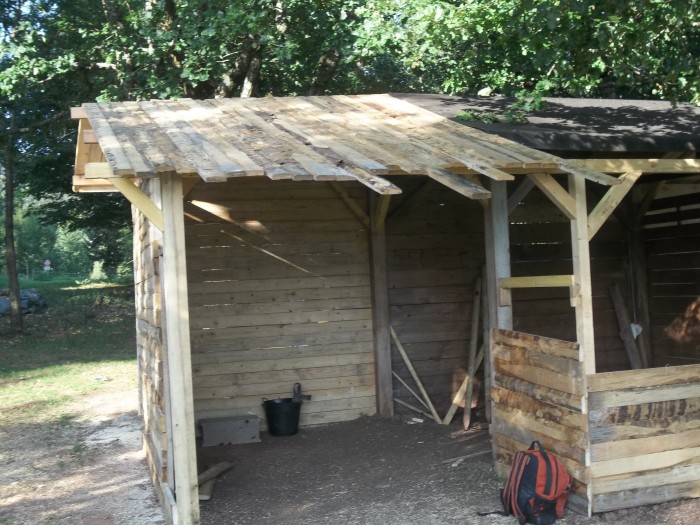
Locate an element on the screen. The image size is (700, 525). black plastic bucket is located at coordinates (283, 411).